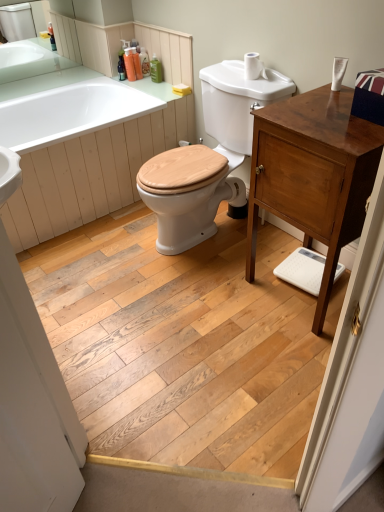
Question: Is white glossy bathtub at upper left in front of or behind green matte bottle at upper center, the fourth toiletry in the left-to-right sequence, in the image?

Choices:
 (A) behind
 (B) front

Answer: (B)

Question: From a real-world perspective, is white glossy bathtub at upper left physically located above or below green matte bottle at upper center, the fourth toiletry in the left-to-right sequence?

Choices:
 (A) above
 (B) below

Answer: (B)

Question: Which is nearer to the white glossy sink at upper center, acting as the 2th sink starting from the back?

Choices:
 (A) white glossy sink at upper left, the second sink when ordered from front to back
 (B) white matte toilet paper at upper right
 (C) green matte countertop at upper left
 (D) natural wood screen door at lower left
 (E) shiny brown cabinet at right

Answer: (B)

Question: Which object is positioned farthest from the white glossy sink at upper center, which ranks as the second sink in top-to-bottom order?

Choices:
 (A) white glossy bathtub at upper left
 (B) natural wood screen door at lower left
 (C) translucent plastic soap dispenser at upper center, the second toiletry positioned from the left
 (D) natural wood floor at center
 (E) green matte countertop at upper left

Answer: (E)